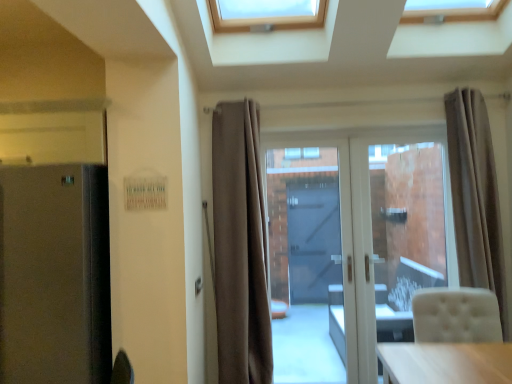
This screenshot has width=512, height=384. Identify the location of white glossy door at center. (308, 256).

What do you see at coordinates (353, 246) in the screenshot? I see `transparent glass door at center` at bounding box center [353, 246].

Find the location of `transparent glass door at center`. transparent glass door at center is located at coordinates (407, 219).

From the image's perspective, is beige fabric curtain at center, positioned as the 2th curtain in right-to-left order, positioned above or below beige fabric curtain at right, which is the first curtain from right to left?

Based on their image positions, beige fabric curtain at center, positioned as the 2th curtain in right-to-left order, is located beneath beige fabric curtain at right, which is the first curtain from right to left.

Is beige fabric curtain at right, which is the first curtain from right to left, at the back of beige fabric curtain at center, the 1th curtain positioned from the left?

beige fabric curtain at center, the 1th curtain positioned from the left, does not have its back to beige fabric curtain at right, which is the first curtain from right to left.

Is white glossy door at center bigger or smaller than beige fabric curtain at right, the 2th curtain in the left-to-right sequence?

Considering their sizes, white glossy door at center takes up less space than beige fabric curtain at right, the 2th curtain in the left-to-right sequence.

Can you confirm if white glossy door at center is positioned to the left of beige fabric curtain at right, the 2th curtain in the left-to-right sequence?

Yes, white glossy door at center is to the left of beige fabric curtain at right, the 2th curtain in the left-to-right sequence.

Considering the positions of point (291, 271) and point (482, 135), is point (291, 271) closer or farther from the camera than point (482, 135)?

Point (291, 271) is positioned farther from the camera compared to point (482, 135).

From a real-world perspective, which is physically below, beige fabric curtain at center, the 1th curtain positioned from the left, or white glossy door at center?

From a 3D spatial view, white glossy door at center is below.

Who is more distant, beige fabric curtain at center, positioned as the 2th curtain in right-to-left order, or white glossy door at center?

white glossy door at center is behind.

Is beige fabric curtain at center, the 1th curtain positioned from the left, positioned far away from white glossy door at center?

They are positioned close to each other.

From the image's perspective, does beige fabric curtain at center, the 1th curtain positioned from the left, appear higher than white glossy door at center?

Yes.

Is transparent glass door at center smaller than beige fabric curtain at right, the 2th curtain in the left-to-right sequence?

Correct, transparent glass door at center occupies less space than beige fabric curtain at right, the 2th curtain in the left-to-right sequence.

From the image's perspective, is transparent glass door at center located above or below beige fabric curtain at right, which is the first curtain from right to left?

Based on their image positions, transparent glass door at center is located beneath beige fabric curtain at right, which is the first curtain from right to left.

What's the angular difference between transparent glass door at center and beige fabric curtain at right, the 2th curtain in the left-to-right sequence,'s facing directions?

0.982 degrees separate the facing orientations of transparent glass door at center and beige fabric curtain at right, the 2th curtain in the left-to-right sequence.

Is beige fabric curtain at right, which is the first curtain from right to left, inside transparent glass door at center?

No, beige fabric curtain at right, which is the first curtain from right to left, is not a part of transparent glass door at center.

From the picture: Are transparent glass door at center and beige fabric curtain at right, the 2th curtain in the left-to-right sequence, located far from each other?

transparent glass door at center is actually quite close to beige fabric curtain at right, the 2th curtain in the left-to-right sequence.

From a real-world perspective, is transparent glass door at center above or below beige fabric curtain at right, the 2th curtain in the left-to-right sequence?

From a real-world perspective, transparent glass door at center is physically below beige fabric curtain at right, the 2th curtain in the left-to-right sequence.

How many degrees apart are the facing directions of transparent glass door at center and beige fabric curtain at right, the 2th curtain in the left-to-right sequence?

The facing directions of transparent glass door at center and beige fabric curtain at right, the 2th curtain in the left-to-right sequence, are 0.982 degrees apart.

Is transparent glass door at center oriented away from beige fabric curtain at right, which is the first curtain from right to left?

No.

Are transparent glass door at center and transparent glass door at center far apart?

transparent glass door at center is near transparent glass door at center, not far away.

From the picture: Is transparent glass door at center not inside transparent glass door at center?

No, transparent glass door at center is inside or overlapping with transparent glass door at center.

Find the location of a particular element. The width and height of the screenshot is (512, 384). door above the transparent glass door at center (from a real-world perspective) is located at coordinates (353, 246).

From a real-world perspective, who is located lower, transparent glass door at center or transparent glass door at center?

From a 3D spatial view, transparent glass door at center is below.

From the picture: In terms of size, does beige fabric curtain at center, positioned as the 2th curtain in right-to-left order, appear bigger or smaller than transparent glass door at center?

Clearly, beige fabric curtain at center, positioned as the 2th curtain in right-to-left order, is smaller in size than transparent glass door at center.

Locate an element on the screen. door behind the beige fabric curtain at center, positioned as the 2th curtain in right-to-left order is located at coordinates (353, 246).

Which object is positioned more to the left, beige fabric curtain at center, the 1th curtain positioned from the left, or transparent glass door at center?

beige fabric curtain at center, the 1th curtain positioned from the left.

Locate an element on the screen. The height and width of the screenshot is (384, 512). curtain that is behind the beige fabric curtain at right, the 2th curtain in the left-to-right sequence is located at coordinates (240, 247).

Where is `garage door located underneath the beige fabric curtain at right, the 2th curtain in the left-to-right sequence (from a real-world perspective)`? This screenshot has width=512, height=384. garage door located underneath the beige fabric curtain at right, the 2th curtain in the left-to-right sequence (from a real-world perspective) is located at coordinates (308, 256).

From the picture: Estimate the real-world distances between objects in this image. Which object is further from satin black fridge at left, beige fabric curtain at center, the 1th curtain positioned from the left, or transparent glass door at center?

transparent glass door at center lies further to satin black fridge at left than the other object.

Looking at the image, which one is located closer to white glossy door at center, satin black fridge at left or beige fabric curtain at right, which is the first curtain from right to left?

beige fabric curtain at right, which is the first curtain from right to left, lies closer to white glossy door at center than the other object.

From the image, which object appears to be nearer to transparent glass door at center, transparent glass door at center or satin black fridge at left?

transparent glass door at center lies closer to transparent glass door at center than the other object.

Which object lies nearer to the anchor point satin black fridge at left, beige fabric curtain at right, the 2th curtain in the left-to-right sequence, or transparent glass door at center?

The object closer to satin black fridge at left is transparent glass door at center.

Which object lies nearer to the anchor point transparent glass door at center, satin black fridge at left or transparent glass door at center?

Based on the image, transparent glass door at center appears to be nearer to transparent glass door at center.

Which object lies nearer to the anchor point beige fabric curtain at center, positioned as the 2th curtain in right-to-left order, transparent glass door at center or white glossy door at center?

white glossy door at center is closer to beige fabric curtain at center, positioned as the 2th curtain in right-to-left order.

From the picture: Which object lies further to the anchor point transparent glass door at center, white glossy door at center or transparent glass door at center?

Based on the image, white glossy door at center appears to be further to transparent glass door at center.

Looking at the image, which one is located further to transparent glass door at center, transparent glass door at center or beige fabric curtain at center, the 1th curtain positioned from the left?

beige fabric curtain at center, the 1th curtain positioned from the left, is further to transparent glass door at center.

The image size is (512, 384). Identify the location of garage door between beige fabric curtain at center, positioned as the 2th curtain in right-to-left order, and transparent glass door at center. (308, 256).

Image resolution: width=512 pixels, height=384 pixels. What are the coordinates of `garage door between satin black fridge at left and beige fabric curtain at right, the 2th curtain in the left-to-right sequence, from left to right` in the screenshot? It's located at (308, 256).

This screenshot has height=384, width=512. In order to click on curtain between satin black fridge at left and transparent glass door at center in this screenshot , I will do `click(240, 247)`.

Where is `window screen between transparent glass door at center and beige fabric curtain at right, which is the first curtain from right to left, from left to right`? The width and height of the screenshot is (512, 384). window screen between transparent glass door at center and beige fabric curtain at right, which is the first curtain from right to left, from left to right is located at coordinates (407, 219).